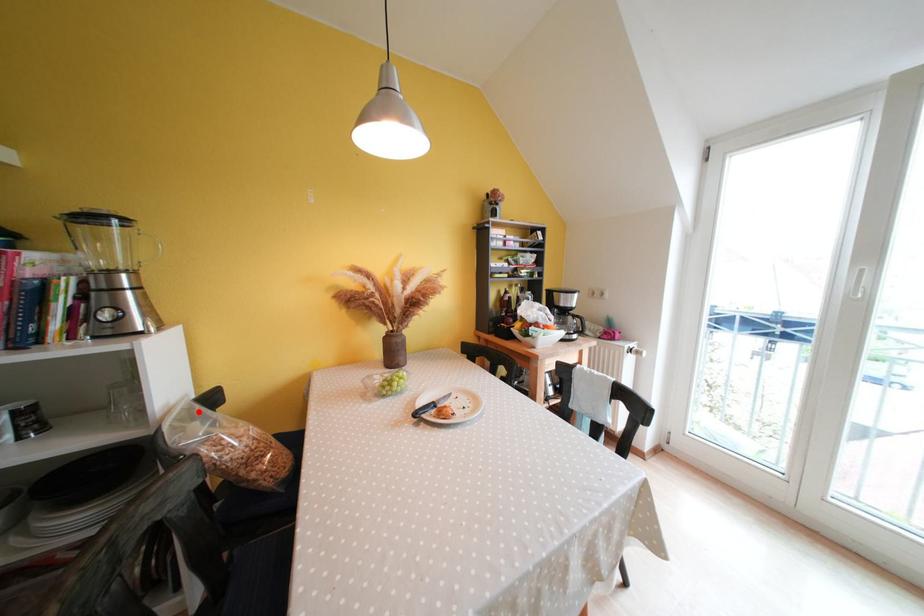
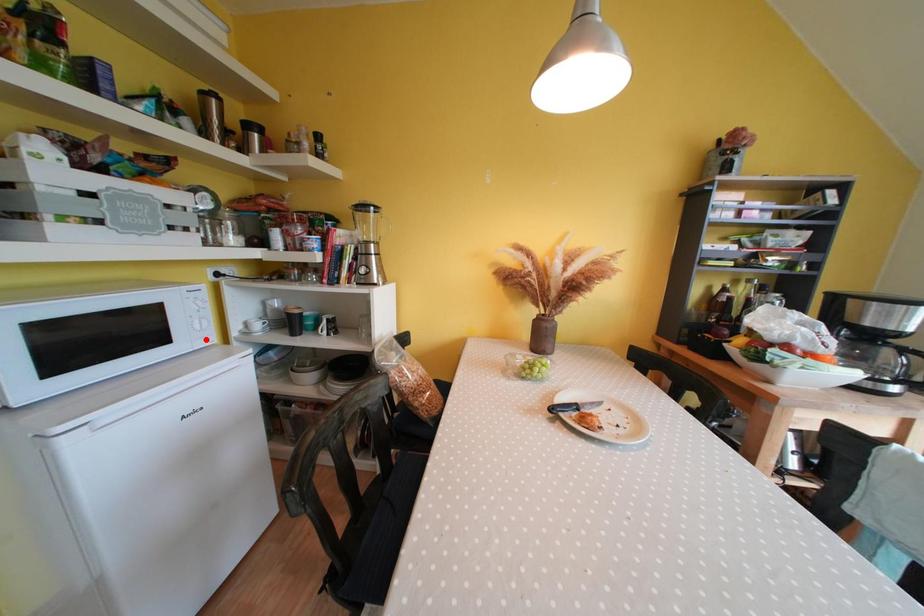
I am providing you with two images of the same scene from different viewpoints. A red point is marked on the first image and another point is marked on the second image. Are the points marked in image1 and image2 representing the same 3D position?

No